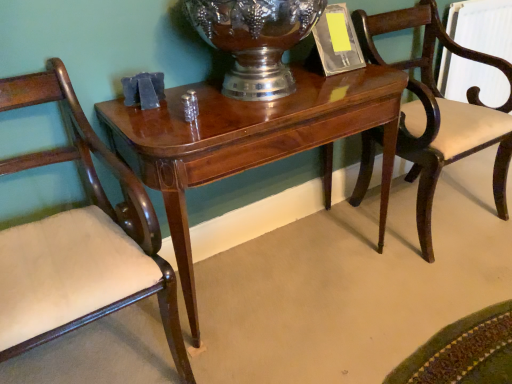
Find the location of `vacant space that's between mahogany wood chair at left, arranged as the first chair when viewed from the left, and shiny wood table at center`. vacant space that's between mahogany wood chair at left, arranged as the first chair when viewed from the left, and shiny wood table at center is located at coordinates (278, 330).